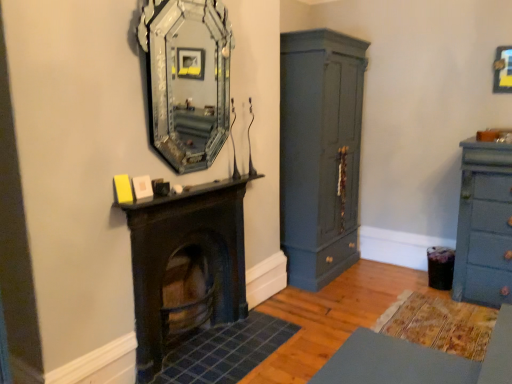
Question: Does dark wood fireplace at center appear on the right side of silver mirrored frame at upper center?

Choices:
 (A) no
 (B) yes

Answer: (A)

Question: Is silver mirrored frame at upper center a part of dark wood fireplace at center?

Choices:
 (A) no
 (B) yes

Answer: (A)

Question: From a real-world perspective, is dark wood fireplace at center physically below silver mirrored frame at upper center?

Choices:
 (A) yes
 (B) no

Answer: (A)

Question: Is dark wood fireplace at center taller than silver mirrored frame at upper center?

Choices:
 (A) yes
 (B) no

Answer: (B)

Question: Does dark wood fireplace at center turn towards silver mirrored frame at upper center?

Choices:
 (A) no
 (B) yes

Answer: (A)

Question: Visually, is silver mirrored frame at upper center positioned to the left or to the right of matte blue dresser at right?

Choices:
 (A) left
 (B) right

Answer: (A)

Question: Is silver mirrored frame at upper center bigger or smaller than matte blue dresser at right?

Choices:
 (A) big
 (B) small

Answer: (B)

Question: From the image's perspective, is silver mirrored frame at upper center positioned above or below matte blue dresser at right?

Choices:
 (A) below
 (B) above

Answer: (B)

Question: From a real-world perspective, is silver mirrored frame at upper center above or below matte blue dresser at right?

Choices:
 (A) above
 (B) below

Answer: (A)

Question: Is matte dark blue cupboard at center right spatially inside matte blue dresser at right, or outside of it?

Choices:
 (A) outside
 (B) inside

Answer: (A)

Question: Based on their sizes in the image, would you say matte dark blue cupboard at center right is bigger or smaller than matte blue dresser at right?

Choices:
 (A) small
 (B) big

Answer: (B)

Question: Relative to matte blue dresser at right, is matte dark blue cupboard at center right in front or behind?

Choices:
 (A) behind
 (B) front

Answer: (A)

Question: From the image's perspective, is matte dark blue cupboard at center right located above or below matte blue dresser at right?

Choices:
 (A) above
 (B) below

Answer: (A)

Question: Is silver mirrored frame at upper center wider or thinner than metallic gold picture frame at upper right?

Choices:
 (A) wide
 (B) thin

Answer: (A)

Question: Is silver mirrored frame at upper center in front of or behind metallic gold picture frame at upper right in the image?

Choices:
 (A) behind
 (B) front

Answer: (B)